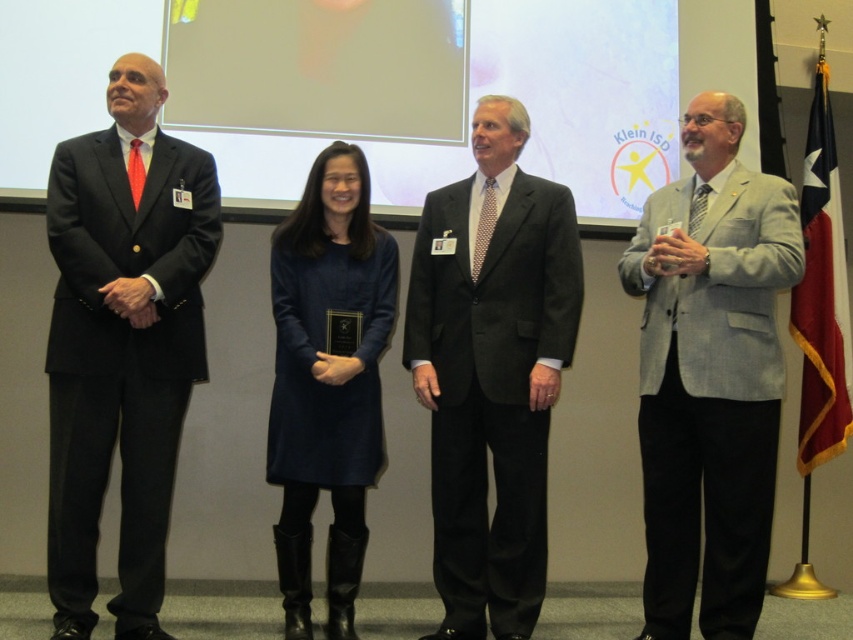
You are a photographer at the event and need to adjust the lighting to ensure both the black suit at left and the dark gray suit at center are well lit. Considering their heights, which suit will require the light to be positioned higher to avoid shadows on their face?

The black suit at left is much taller than the dark gray suit at center, so the light should be positioned higher to accommodate their greater height, ensuring their face is well lit without shadows.

You are a photographer at the event and need to ensure all attendees are visible in the group photo. The gray textured blazer at right and dark gray suit at center are two people in the photo. Which one is shorter in height?

The gray textured blazer at right is shorter than the dark gray suit at center, so the person wearing the gray textured blazer at right is shorter.

Based on the scene description, where is the gray textured blazer at right located in relation to the other individuals?

The gray textured blazer at right is located at point 0.586 on the x axis and 0.834 on the y axis.